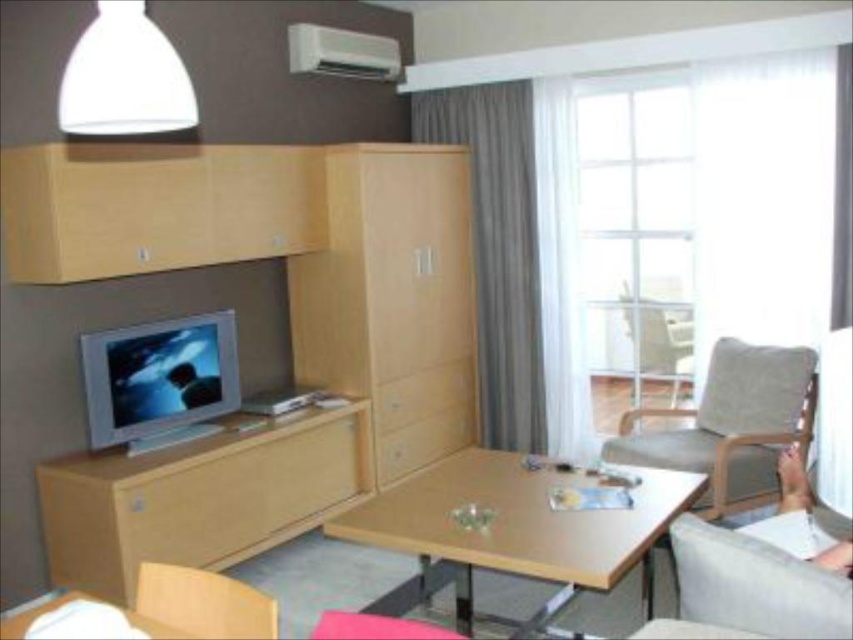
Based on the photo, is wooden table at center wider than light brown wood armchair at lower left?

Yes.

Does wooden table at center appear under light brown wood armchair at lower left?

Yes.

This screenshot has width=853, height=640. What do you see at coordinates (509, 531) in the screenshot?
I see `wooden table at center` at bounding box center [509, 531].

Image resolution: width=853 pixels, height=640 pixels. In order to click on wooden table at center in this screenshot , I will do `click(509, 531)`.

Which of these two, wooden table at center or wooden table at lower center, stands shorter?

wooden table at lower center is shorter.

Does wooden table at center appear on the left side of wooden table at lower center?

Incorrect, wooden table at center is not on the left side of wooden table at lower center.

The width and height of the screenshot is (853, 640). Identify the location of wooden table at center. (509, 531).

In order to click on wooden table at center in this screenshot , I will do `click(509, 531)`.

Where is `light brown fabric armchair at right`? This screenshot has height=640, width=853. light brown fabric armchair at right is located at coordinates (730, 422).

Is light brown fabric armchair at right further to camera compared to white matte lampshade at upper center?

Yes, light brown fabric armchair at right is behind white matte lampshade at upper center.

Locate an element on the screen. light brown fabric armchair at right is located at coordinates (730, 422).